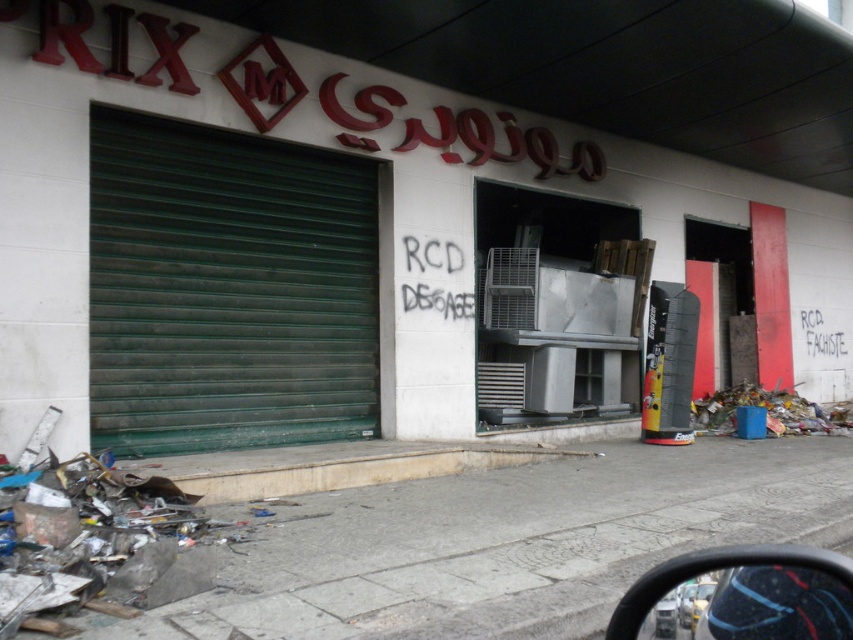
Can you confirm if gray concrete pavement at lower center is bigger than beige concrete curb at lower center?

No, gray concrete pavement at lower center is not bigger than beige concrete curb at lower center.

Does gray concrete pavement at lower center have a lesser height compared to beige concrete curb at lower center?

Yes.

Does point (697, 515) come in front of point (427, 476)?

Yes, it is.

Where is `gray concrete pavement at lower center`? This screenshot has height=640, width=853. gray concrete pavement at lower center is located at coordinates (508, 544).

Consider the image. Between metallic gray refrigerator at center and beige concrete curb at lower center, which one has more height?

metallic gray refrigerator at center is taller.

Is metallic gray refrigerator at center positioned behind beige concrete curb at lower center?

Yes, metallic gray refrigerator at center is behind beige concrete curb at lower center.

The width and height of the screenshot is (853, 640). Describe the element at coordinates (405, 211) in the screenshot. I see `metallic gray refrigerator at center` at that location.

Find the location of `metallic gray refrigerator at center`. metallic gray refrigerator at center is located at coordinates (405, 211).

Locate an element on the screen. This screenshot has width=853, height=640. metallic gray refrigerator at center is located at coordinates (405, 211).

Does metallic gray refrigerator at center appear on the right side of gray concrete pavement at lower center?

Correct, you'll find metallic gray refrigerator at center to the right of gray concrete pavement at lower center.

Is point (294, 211) more distant than point (321, 532)?

Yes, point (294, 211) is farther from viewer.

You are a GUI agent. You are given a task and a screenshot of the screen. Output one action in this format:
    pyautogui.click(x=<x>, y=<y>)
    Task: Click on the metallic gray refrigerator at center
    
    Given the screenshot: What is the action you would take?
    pyautogui.click(x=405, y=211)